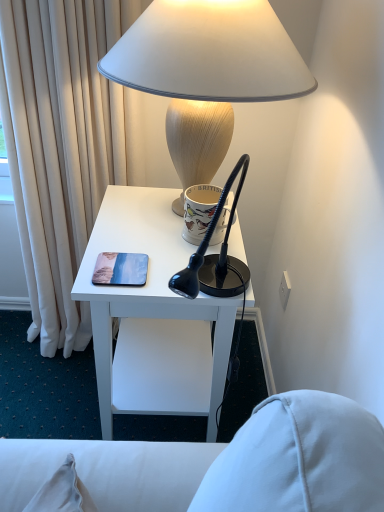
Question: From a real-world perspective, is white matte lampshade at upper center above or below white ceramic mug at upper center?

Choices:
 (A) below
 (B) above

Answer: (B)

Question: In the image, is white matte lampshade at upper center positioned in front of or behind white ceramic mug at upper center?

Choices:
 (A) behind
 (B) front

Answer: (B)

Question: Which object is the farthest from the white ceramic mug at upper center?

Choices:
 (A) white matte lampshade at upper center
 (B) white glossy desk at center

Answer: (A)

Question: Considering the real-world distances, which object is farthest from the white ceramic mug at upper center?

Choices:
 (A) white matte lampshade at upper center
 (B) white glossy desk at center

Answer: (A)